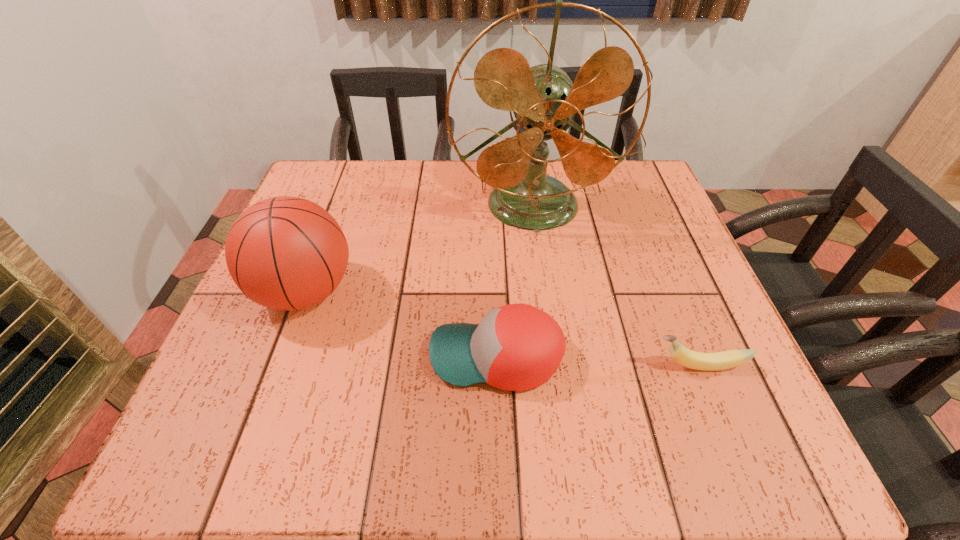
The image size is (960, 540). Find the location of `free location located at the brim of the baseball cap`. free location located at the brim of the baseball cap is located at coordinates (312, 357).

The height and width of the screenshot is (540, 960). Identify the location of vacant space situated 0.260m at the stem of the banana. (501, 366).

Locate an element on the screen. The image size is (960, 540). blank area located at the stem of the banana is located at coordinates (615, 366).

I want to click on free space located 0.400m at the stem of the banana, so click(421, 366).

Where is `object that is at the far edge`? object that is at the far edge is located at coordinates (544, 100).

I want to click on object positioned at the left edge, so click(287, 253).

Find the location of `fan that is at the right edge`. fan that is at the right edge is located at coordinates (544, 100).

In order to click on banana that is at the right edge in this screenshot , I will do `click(723, 360)`.

Find the location of a particular element. Image resolution: width=960 pixels, height=540 pixels. object that is at the far right corner is located at coordinates (544, 100).

The image size is (960, 540). I want to click on vacant space at the far edge of the desktop, so click(454, 165).